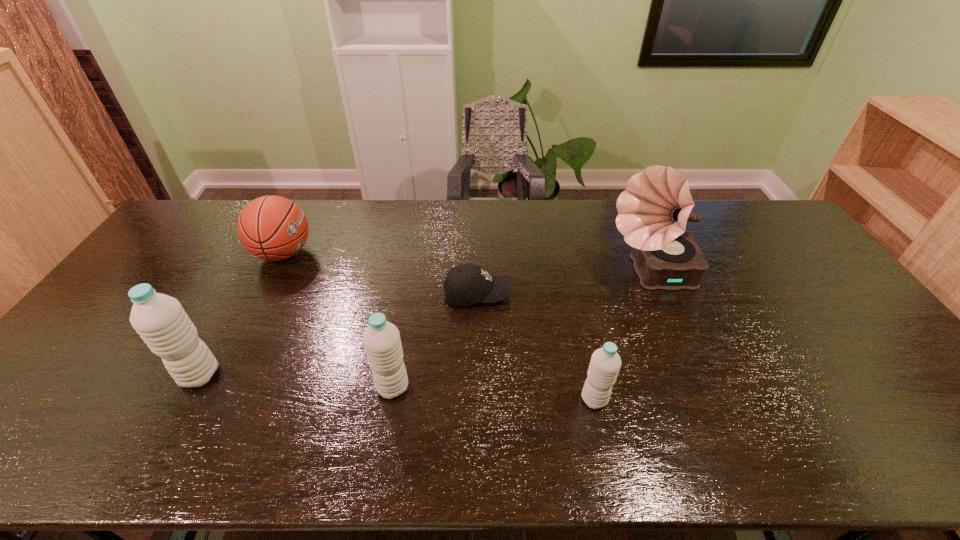
Locate an element on the screen. Image resolution: width=960 pixels, height=540 pixels. the rightmost object is located at coordinates (654, 209).

The image size is (960, 540). I want to click on vacant space located 0.390m on the back of the second tallest object, so click(262, 261).

This screenshot has height=540, width=960. I want to click on vacant space located on the back of the second shortest water bottle, so click(401, 336).

The height and width of the screenshot is (540, 960). What are the coordinates of `free spot located on the back of the shortest water bottle` in the screenshot? It's located at (585, 355).

Image resolution: width=960 pixels, height=540 pixels. I want to click on free space located 0.320m on the front-facing side of the third object from right to left, so click(x=619, y=294).

Identify the location of blank area located 0.060m on the logo side of the basketball. (332, 253).

Identify the location of vacant space located from the horn of the rightmost object. This screenshot has height=540, width=960. coord(579,274).

Where is `vacant region located from the horn of the rightmost object`? The width and height of the screenshot is (960, 540). vacant region located from the horn of the rightmost object is located at coordinates (564, 274).

At what (x,y) coordinates should I click in order to perform the action: click on vacant space located 0.370m from the horn of the rightmost object. Please return your answer as a coordinate pair (x, y). The height and width of the screenshot is (540, 960). Looking at the image, I should click on (487, 274).

At what (x,y) coordinates should I click in order to perform the action: click on object located in the far edge section of the desktop. Please return your answer as a coordinate pair (x, y). Image resolution: width=960 pixels, height=540 pixels. Looking at the image, I should click on (274, 228).